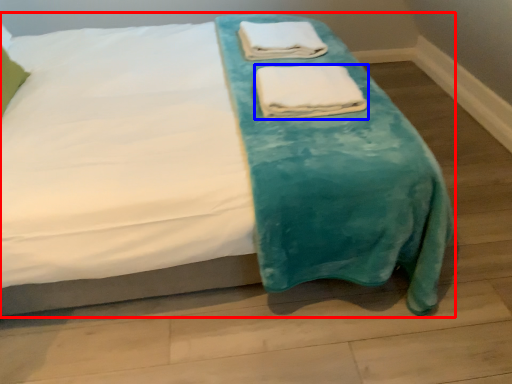
Question: Among these objects, which one is farthest to the camera, bed (highlighted by a red box) or towel (highlighted by a blue box)?

Choices:
 (A) bed
 (B) towel

Answer: (B)